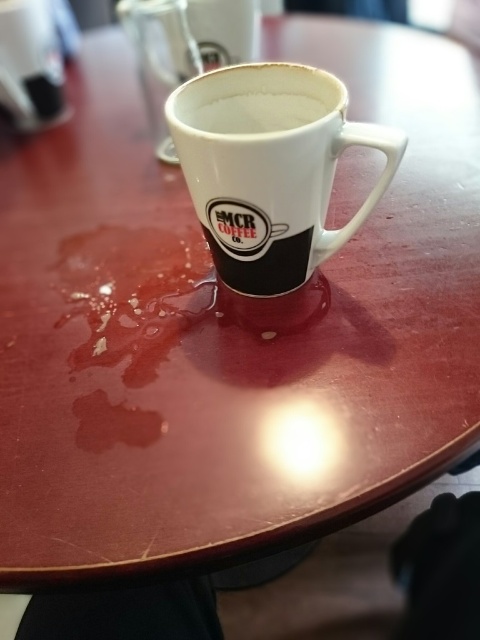
Question: Which object is the farthest from the white ceramic mug at center?

Choices:
 (A) white matte cup at center
 (B) white glossy saucer at upper left

Answer: (B)

Question: Where is white ceramic mug at center located in relation to white glossy saucer at upper left in the image?

Choices:
 (A) above
 (B) below

Answer: (B)

Question: Which object is the farthest from the white matte cup at center?

Choices:
 (A) white glossy saucer at upper left
 (B) white ceramic mug at center

Answer: (A)

Question: Is white ceramic mug at center thinner than white glossy saucer at upper left?

Choices:
 (A) yes
 (B) no

Answer: (B)

Question: Is white ceramic mug at center thinner than white glossy saucer at upper left?

Choices:
 (A) yes
 (B) no

Answer: (B)

Question: Considering the real-world distances, which object is farthest from the white glossy saucer at upper left?

Choices:
 (A) white ceramic mug at center
 (B) white matte cup at center

Answer: (A)